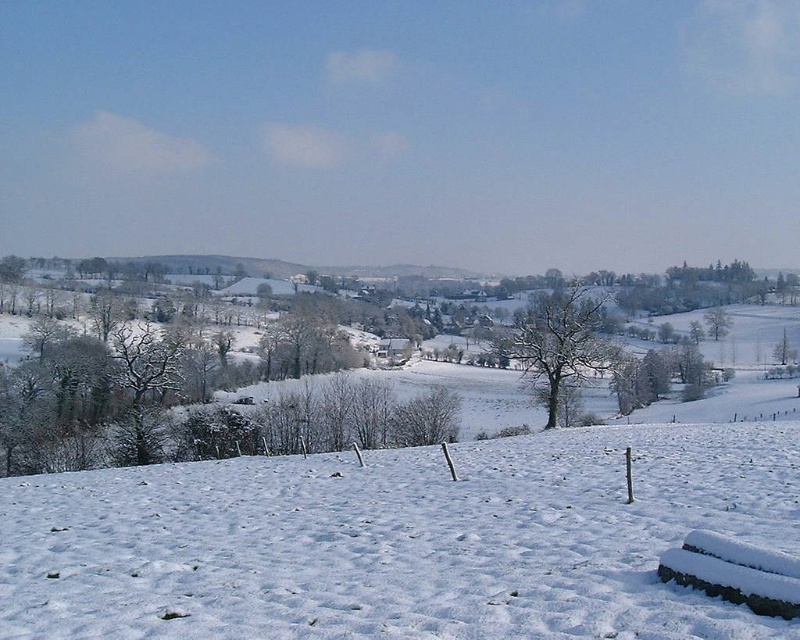
Can you confirm if white snow at lower center is bigger than bare snow-covered tree at center?

Yes.

Who is more distant from viewer, [494,518] or [550,401]?

The point [550,401] is more distant.

Locate an element on the screen. This screenshot has width=800, height=640. white snow at lower center is located at coordinates click(400, 540).